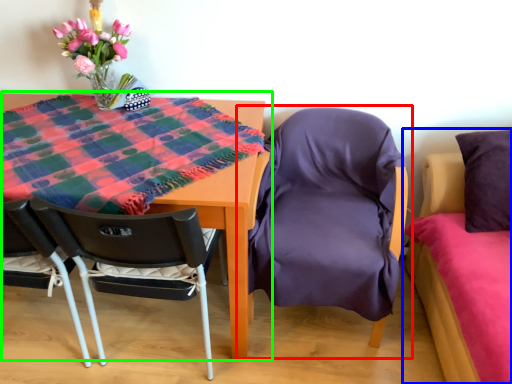
Question: Which object is the closest to the chair (highlighted by a red box)? Choose among these: bed (highlighted by a blue box) or table (highlighted by a green box).

Choices:
 (A) bed
 (B) table

Answer: (A)